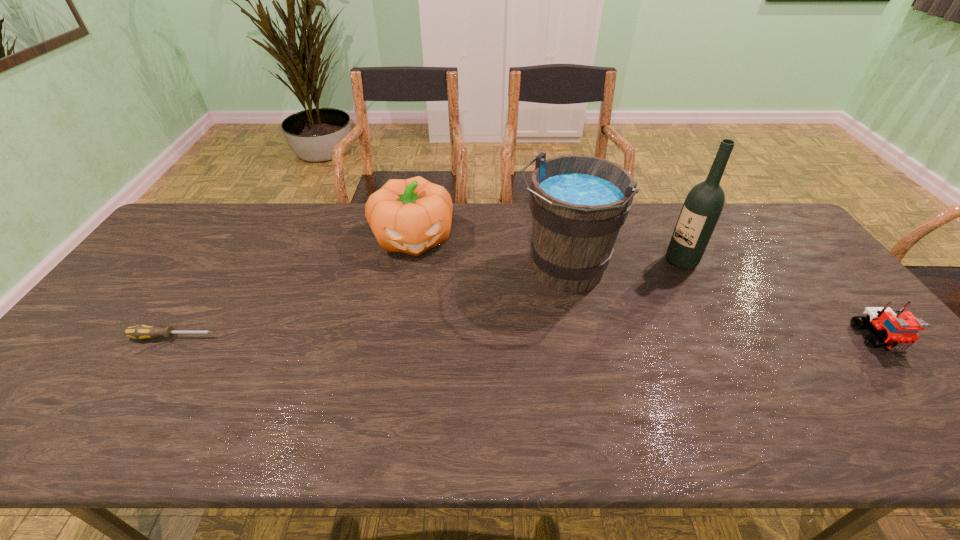
I want to click on free space located 0.060m on the front-facing side of the Lego, so click(910, 376).

This screenshot has width=960, height=540. Identify the location of vacant space located on the labeled side of the wine bottle. click(642, 287).

This screenshot has width=960, height=540. Identify the location of vacant position located 0.370m on the labeled side of the wine bottle. (588, 325).

Find the location of a particular element. The width and height of the screenshot is (960, 540). free space located on the labeled side of the wine bottle is located at coordinates (651, 282).

Identify the location of free space located with a handle on the side of the second tallest object. This screenshot has width=960, height=540. (478, 373).

This screenshot has height=540, width=960. Find the location of `vacant space located 0.090m with a handle on the side of the second tallest object`. vacant space located 0.090m with a handle on the side of the second tallest object is located at coordinates (522, 321).

Find the location of a particular element. The width and height of the screenshot is (960, 540). blank space located 0.160m with a handle on the side of the second tallest object is located at coordinates (508, 338).

Identify the location of vacant point located 0.140m on the carved face of the pumpkin. (421, 297).

Locate an element on the screen. The width and height of the screenshot is (960, 540). free space located on the carved face of the pumpkin is located at coordinates (429, 338).

Find the location of a particular element. This screenshot has height=540, width=960. vacant region located on the carved face of the pumpkin is located at coordinates (419, 280).